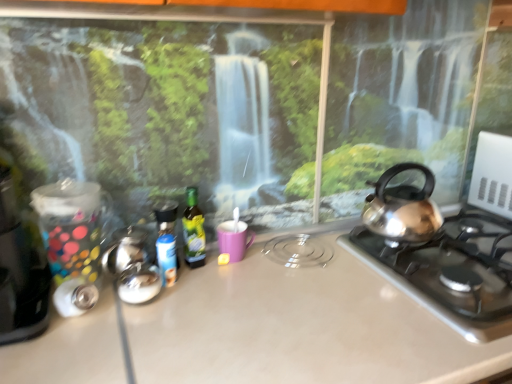
This screenshot has height=384, width=512. I want to click on vacant area that lies in front of matte purple mug at center, so (x=231, y=291).